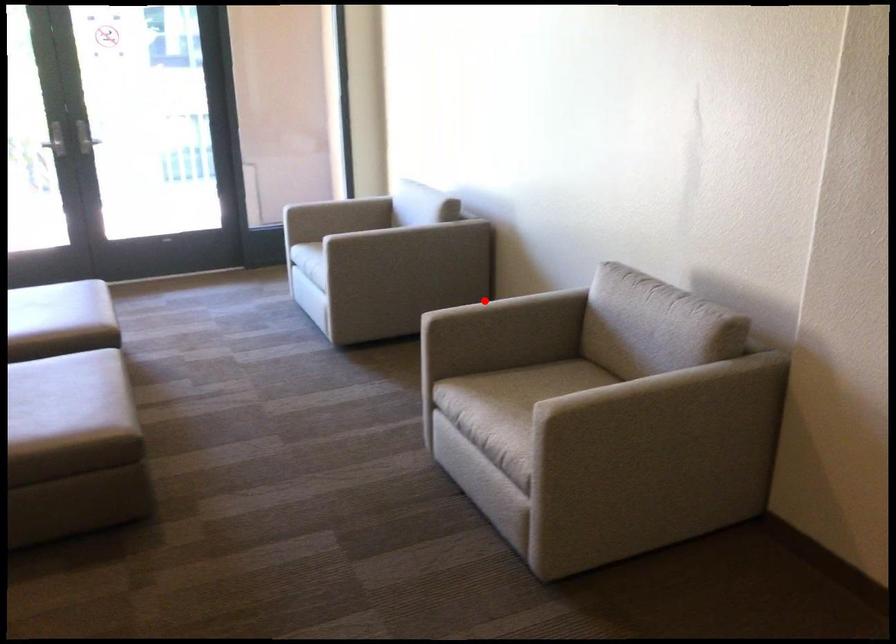
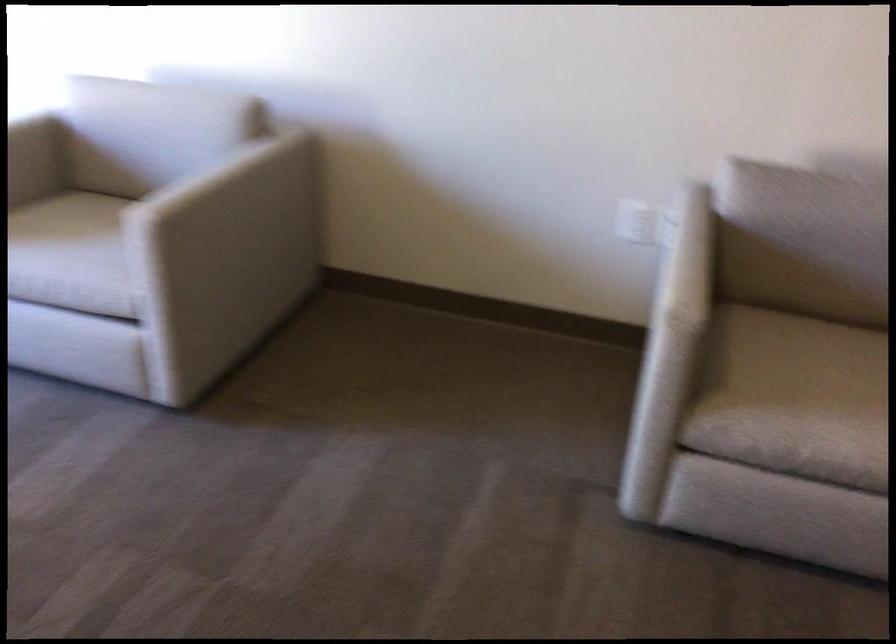
Locate, in the second image, the point that corresponds to the highlighted location in the first image.

(685, 259)